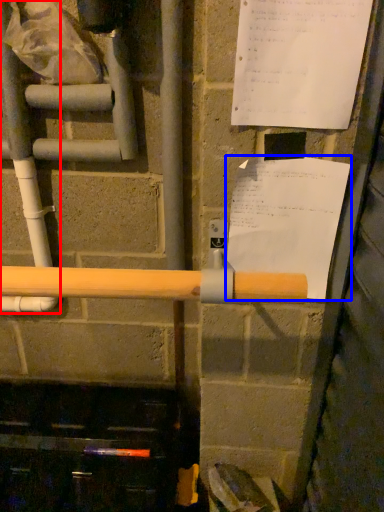
Question: Which of the following is the closest to the observer, water pipe (highlighted by a red box) or paper (highlighted by a blue box)?

Choices:
 (A) water pipe
 (B) paper

Answer: (B)